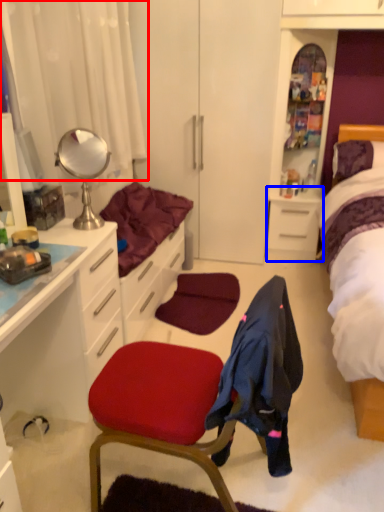
Question: Which object is further to the camera taking this photo, curtain (highlighted by a red box) or file cabinet (highlighted by a blue box)?

Choices:
 (A) curtain
 (B) file cabinet

Answer: (B)